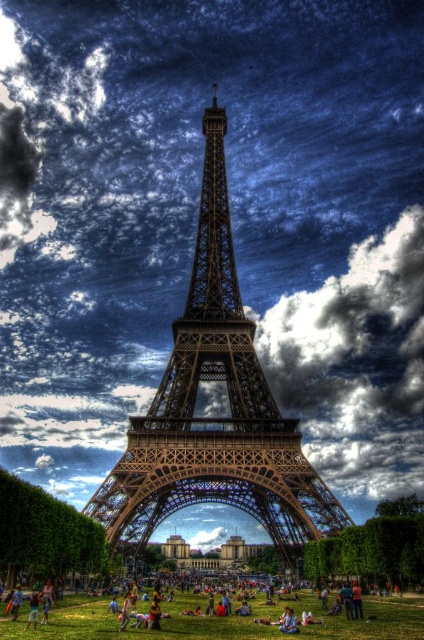
You are a photographer planning to take a wide shot of the brown metallic eiffel tower at center and the green grass at lower center. Which object will occupy more space in the photo?

The brown metallic eiffel tower at center is bigger than green grass at lower center, so it will occupy more space in the photo.

You are standing at the origin point of the coordinate system in the image. The image has a coordinate system where the bottom left corner is the origin point. The brown metallic eiffel tower at center is located at point (214, 417). You want to walk towards the brown metallic eiffel tower at center. In which direction should you move from your current position?

The brown metallic eiffel tower at center is located at point (214, 417). Since you are at the origin point, which is the bottom left corner, you should move towards the right and upwards to reach the brown metallic eiffel tower at center.

You are standing on the green grass at lower center and want to take a photo of the brown metallic eiffel tower at center. In which direction should you point your camera to capture the tower?

The brown metallic eiffel tower at center is to the left of green grass at lower center, so you should point your camera to the left to capture the tower.